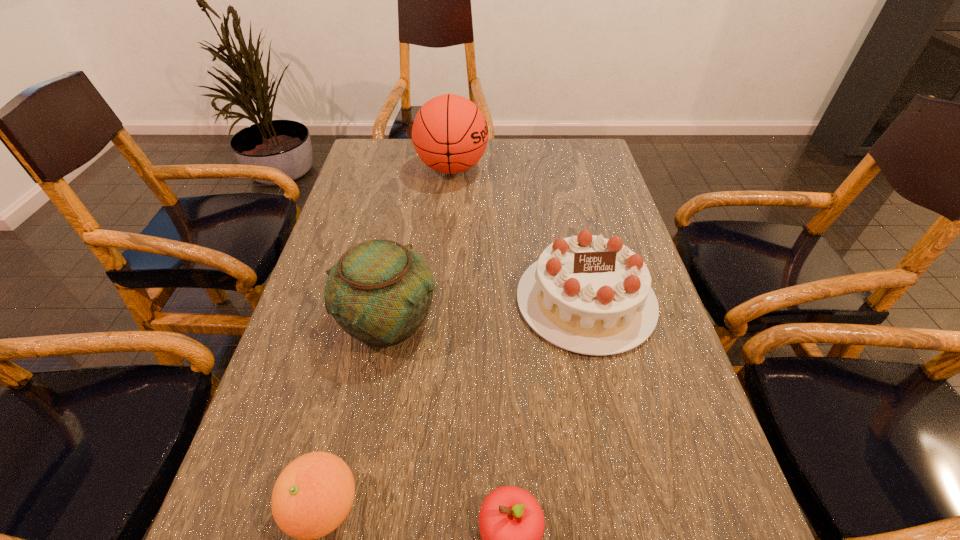
Locate an element on the screen. object that is the third closest to the second tallest object is located at coordinates (511, 522).

Where is `free location that satisfies the following two spatial constraints: 1. on the side with logo of the basketball; 2. on the back side of the birthday cake`? free location that satisfies the following two spatial constraints: 1. on the side with logo of the basketball; 2. on the back side of the birthday cake is located at coordinates (441, 300).